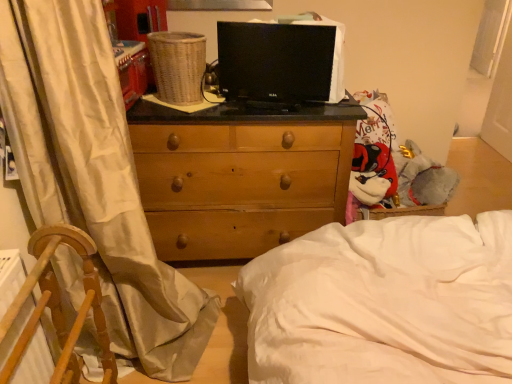
This screenshot has height=384, width=512. I want to click on vacant region above woven brown basket at upper center (from a real-world perspective), so click(172, 34).